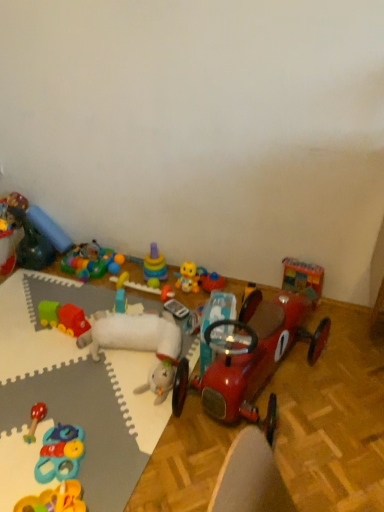
Find the location of a particular element. The width and height of the screenshot is (384, 512). vacant space situated on the left part of wooden rattle at lower left, positioned as the 6th toy in left-to-right order is located at coordinates (11, 419).